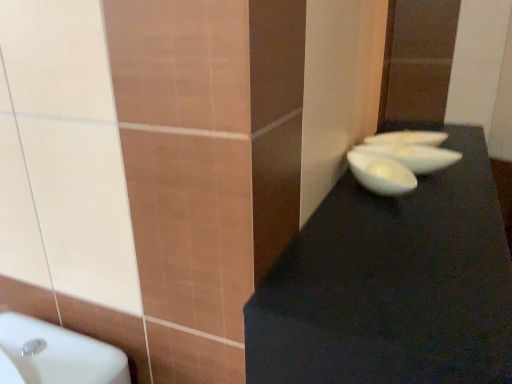
Question: From the image's perspective, relative to white glossy bowl at center, the 2th basin in the back-to-front sequence, is white glossy bowl at center right above or below?

Choices:
 (A) below
 (B) above

Answer: (A)

Question: From a real-world perspective, relative to white glossy bowl at center, the 2th basin in the back-to-front sequence, is white glossy bowl at center right vertically above or below?

Choices:
 (A) above
 (B) below

Answer: (B)

Question: Which is nearer to the white glossy bowl at upper right, positioned as the first basin in back-to-front order?

Choices:
 (A) black matte table at right
 (B) white glossy bowl at center right
 (C) white glossy bowl at center, the 2th basin in the back-to-front sequence

Answer: (C)

Question: Based on their relative distances, which object is nearer to the white glossy bowl at center right?

Choices:
 (A) black matte table at right
 (B) white glossy bowl at center, the first basin viewed from the front
 (C) white glossy bowl at upper right, positioned as the first basin in back-to-front order

Answer: (B)